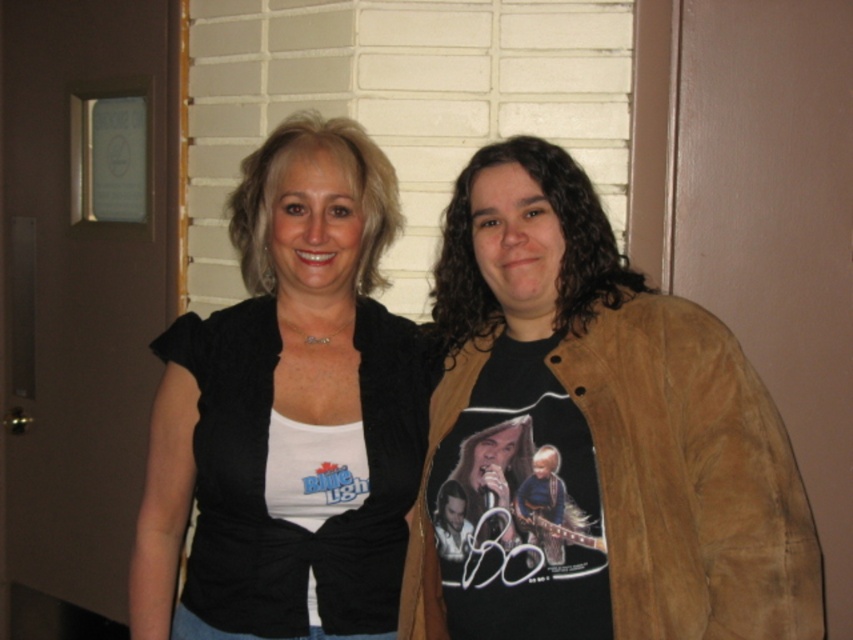
Question: Among these points, which one is farthest from the camera?

Choices:
 (A) (270, 502)
 (B) (595, 456)

Answer: (A)

Question: Can you confirm if suede jacket at right is positioned above matte black shirt at center?

Choices:
 (A) yes
 (B) no

Answer: (B)

Question: Is suede jacket at right positioned in front of matte black shirt at center?

Choices:
 (A) no
 (B) yes

Answer: (B)

Question: Does suede jacket at right appear under matte black shirt at center?

Choices:
 (A) yes
 (B) no

Answer: (A)